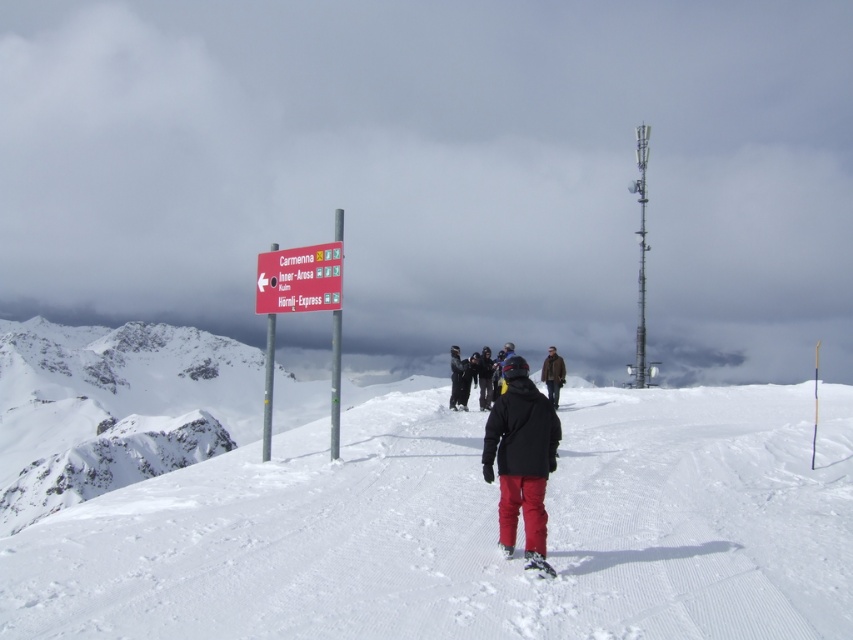
Question: Considering the relative positions of white powdery snow at center and black jacket at center in the image provided, where is white powdery snow at center located with respect to black jacket at center?

Choices:
 (A) right
 (B) left

Answer: (A)

Question: Considering the relative positions of cloudy sky at upper center and metallic signpost at center in the image provided, where is cloudy sky at upper center located with respect to metallic signpost at center?

Choices:
 (A) above
 (B) below

Answer: (A)

Question: Does matte black jacket at center have a greater width compared to brown leather jacket at center?

Choices:
 (A) no
 (B) yes

Answer: (A)

Question: Which object appears farthest from the camera in this image?

Choices:
 (A) white powdery snow at center
 (B) cloudy sky at upper center
 (C) matte black jacket at center
 (D) metallic signpost at center

Answer: (B)

Question: Which object appears farthest from the camera in this image?

Choices:
 (A) brown leather jacket at center
 (B) red plastic sign at center
 (C) white powdery snow at center
 (D) black jacket at center

Answer: (D)

Question: Which of these objects is positioned closest to the cloudy sky at upper center?

Choices:
 (A) metallic signpost at center
 (B) matte black jacket at center
 (C) white plastic ski at center

Answer: (A)